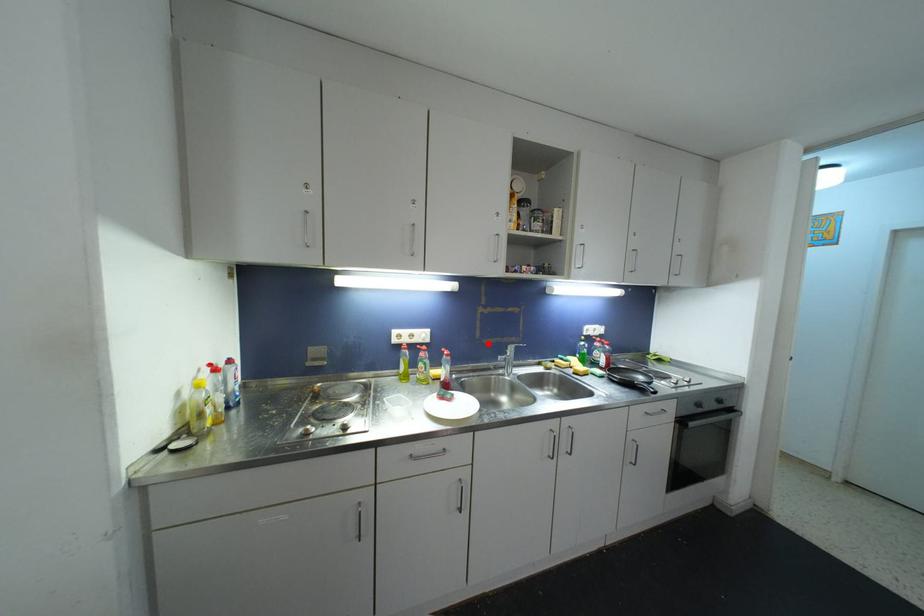
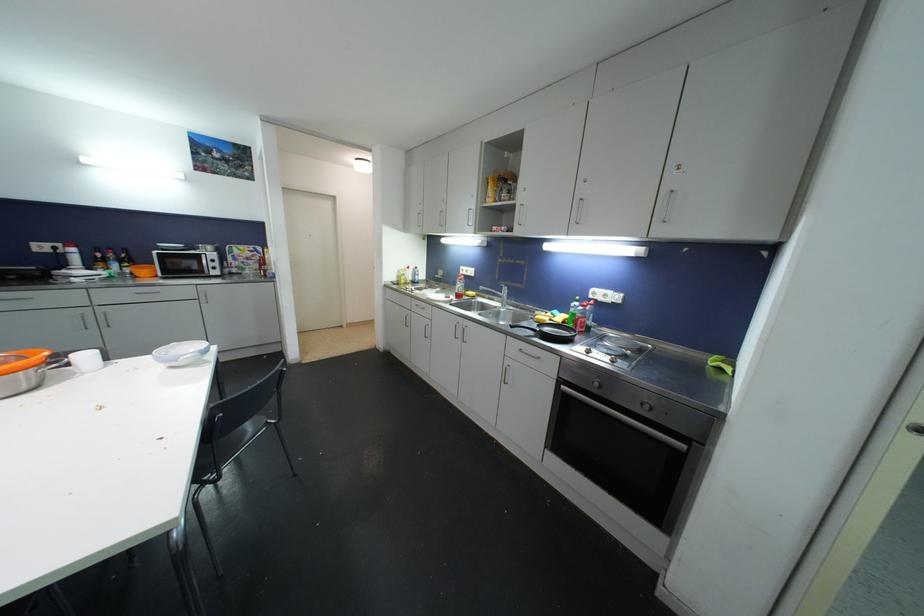
The point at the highlighted location is marked in the first image. Where is the corresponding point in the second image?

(504, 285)